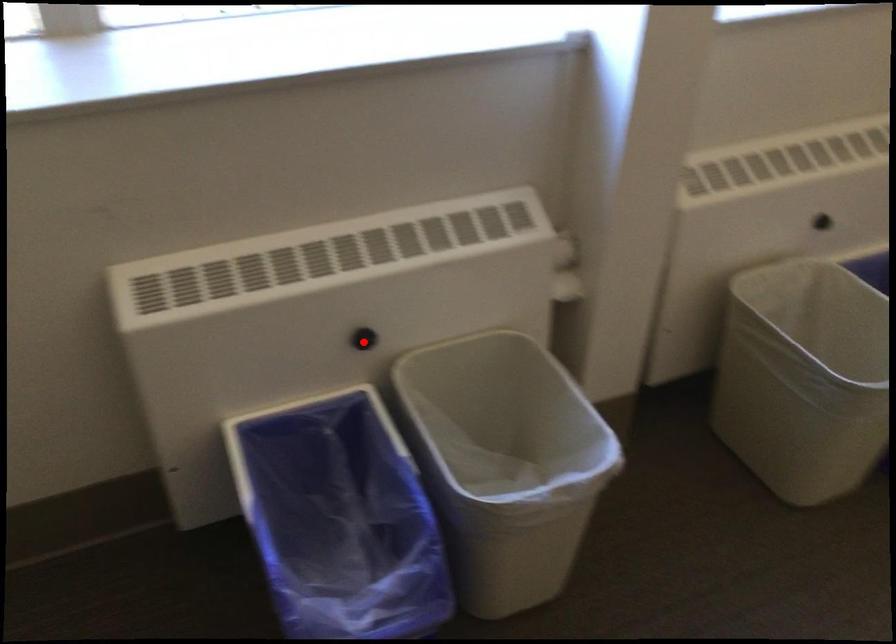
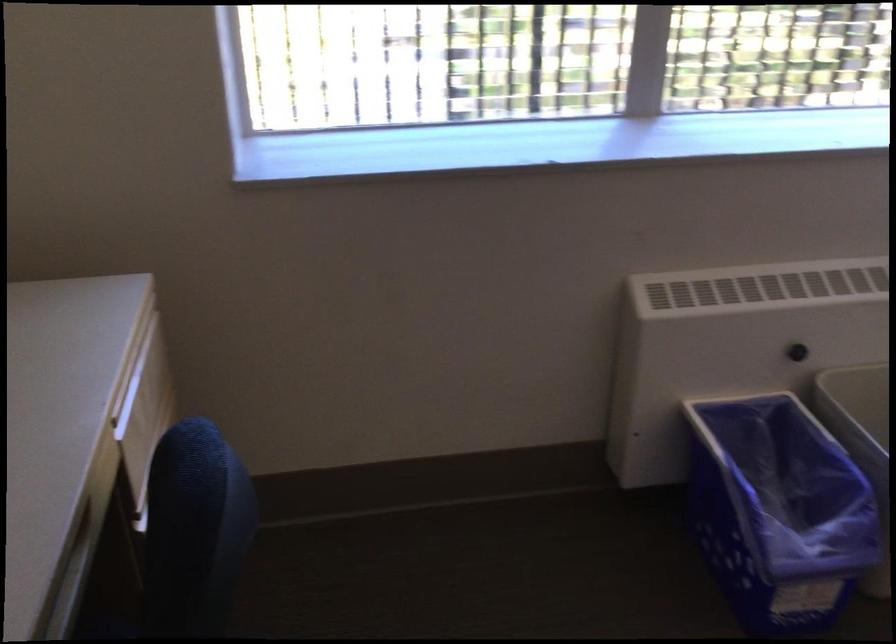
Question: A red point is marked in image1. In image2, is the corresponding 3D point closer to the camera or farther? Reply with the corresponding letter.

Choices:
 (A) The corresponding 3D point is closer.
 (B) The corresponding 3D point is farther.

Answer: (B)